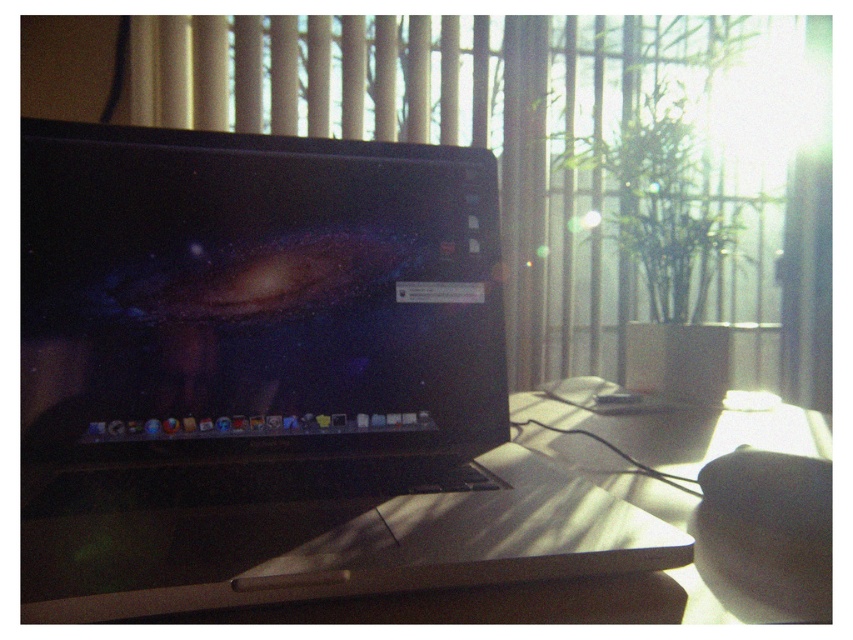
Between transparent glass window at center and smooth wooden table at center, which one has more height?

With more height is transparent glass window at center.

Does point (366, 88) come farther from viewer compared to point (177, 560)?

Yes, point (366, 88) is behind point (177, 560).

At what (x,y) coordinates should I click in order to perform the action: click on transparent glass window at center. Please return your answer as a coordinate pair (x, y). This screenshot has height=640, width=853. Looking at the image, I should click on (440, 134).

Does satin black laptop at center appear on the right side of transparent glass window at center?

No, satin black laptop at center is not to the right of transparent glass window at center.

Which is behind, point (450, 419) or point (488, 33)?

The point (488, 33) is more distant.

The height and width of the screenshot is (640, 853). I want to click on satin black laptop at center, so click(276, 380).

Which is above, satin black laptop at center or smooth wooden table at center?

Positioned higher is satin black laptop at center.

Who is more distant from viewer, (473, 227) or (445, 518)?

Point (473, 227)

This screenshot has height=640, width=853. What do you see at coordinates (276, 380) in the screenshot?
I see `satin black laptop at center` at bounding box center [276, 380].

In order to click on satin black laptop at center in this screenshot , I will do `click(276, 380)`.